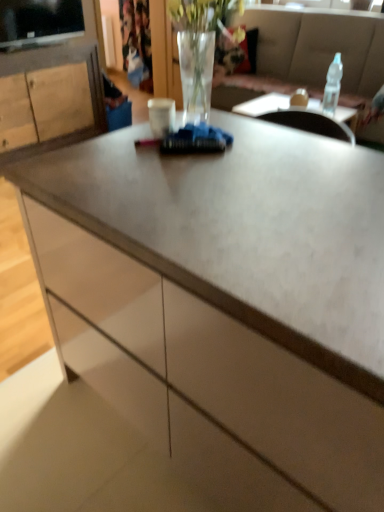
Question: Considering the relative sizes of clear glass vase at center and translucent glass vase at upper center in the image provided, is clear glass vase at center taller than translucent glass vase at upper center?

Choices:
 (A) no
 (B) yes

Answer: (A)

Question: Does clear glass vase at center have a lesser height compared to translucent glass vase at upper center?

Choices:
 (A) no
 (B) yes

Answer: (B)

Question: Is clear glass vase at center wider than translucent glass vase at upper center?

Choices:
 (A) no
 (B) yes

Answer: (B)

Question: Is clear glass vase at center positioned behind translucent glass vase at upper center?

Choices:
 (A) no
 (B) yes

Answer: (A)

Question: From a real-world perspective, is clear glass vase at center positioned under translucent glass vase at upper center based on gravity?

Choices:
 (A) yes
 (B) no

Answer: (B)

Question: Is matte gray couch at upper center wider or thinner than translucent glass vase at upper center?

Choices:
 (A) thin
 (B) wide

Answer: (B)

Question: Is matte gray couch at upper center to the left or to the right of translucent glass vase at upper center in the image?

Choices:
 (A) right
 (B) left

Answer: (A)

Question: From the image's perspective, is matte gray couch at upper center positioned above or below translucent glass vase at upper center?

Choices:
 (A) below
 (B) above

Answer: (A)

Question: In terms of size, does matte gray couch at upper center appear bigger or smaller than translucent glass vase at upper center?

Choices:
 (A) small
 (B) big

Answer: (B)

Question: Considering the positions of translucent glass vase at upper center and wooden cabinet at left in the image, is translucent glass vase at upper center taller or shorter than wooden cabinet at left?

Choices:
 (A) tall
 (B) short

Answer: (B)

Question: From a real-world perspective, is translucent glass vase at upper center physically located above or below wooden cabinet at left?

Choices:
 (A) above
 (B) below

Answer: (A)

Question: Is translucent glass vase at upper center wider or thinner than wooden cabinet at left?

Choices:
 (A) thin
 (B) wide

Answer: (A)

Question: Based on their positions, is translucent glass vase at upper center located to the left or right of wooden cabinet at left?

Choices:
 (A) left
 (B) right

Answer: (B)

Question: From a real-world perspective, is clear glass vase at center physically located above or below clear plastic bottle at upper right?

Choices:
 (A) below
 (B) above

Answer: (B)

Question: Do you think clear glass vase at center is within clear plastic bottle at upper right, or outside of it?

Choices:
 (A) inside
 (B) outside

Answer: (B)